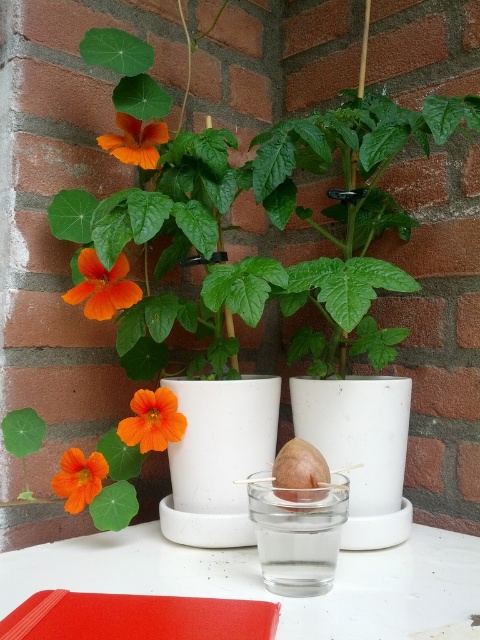
You are a gardener who wants to water the plants in the garden. You have a watering can and see the orange matte flower at left and the orange matte flower at lower left. Which flower should you water first if you want to start with the larger one?

The orange matte flower at left is bigger than orange matte flower at lower left, so you should water the orange matte flower at left first.